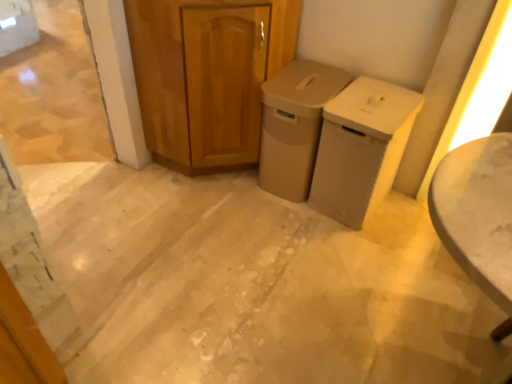
At what (x,y) coordinates should I click in order to perform the action: click on free space above beige textured waste bin at center-right, acting as the second waste container starting from the left (from a real-world perspective). Please return your answer as a coordinate pair (x, y). Image resolution: width=512 pixels, height=384 pixels. Looking at the image, I should click on pyautogui.click(x=375, y=99).